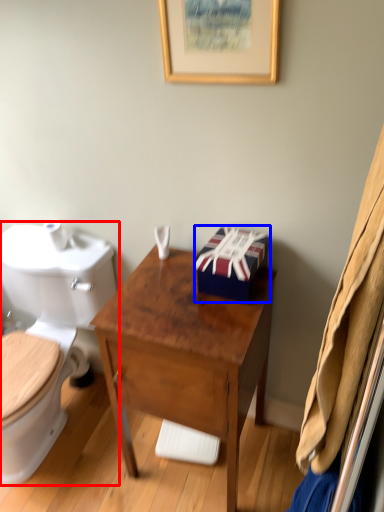
Question: Which of the following is the closest to the observer, toilet (highlighted by a red box) or box (highlighted by a blue box)?

Choices:
 (A) toilet
 (B) box

Answer: (A)